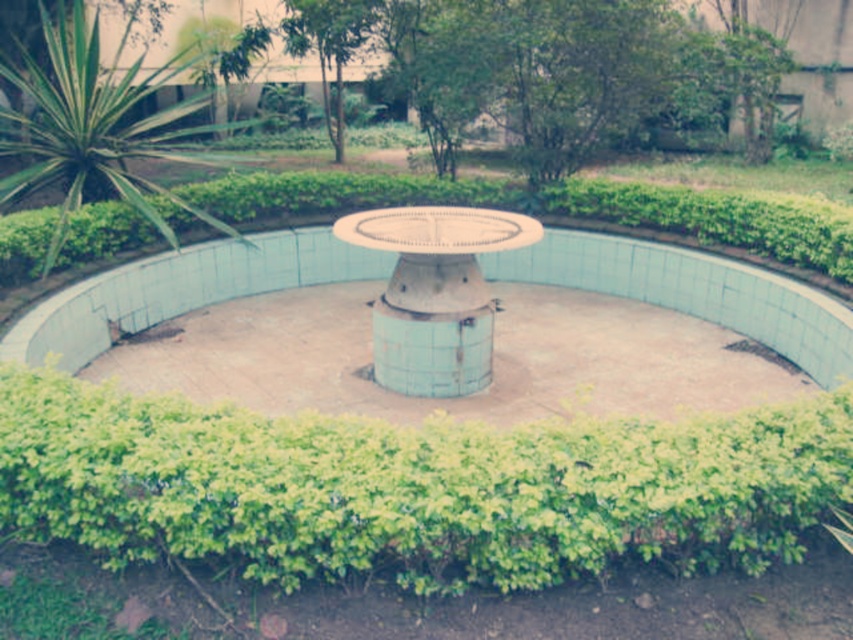
Is point (711, 385) more distant than point (381, 298)?

Yes.

Which is in front, point (782, 292) or point (476, 252)?

Positioned in front is point (476, 252).

The image size is (853, 640). I want to click on blue concrete pool at center, so click(x=492, y=330).

Where is `blue concrete pool at center`? This screenshot has width=853, height=640. blue concrete pool at center is located at coordinates (492, 330).

Is point (215, 358) in front of point (73, 112)?

Yes, point (215, 358) is closer to viewer.

Where is `blue concrete pool at center`? This screenshot has width=853, height=640. blue concrete pool at center is located at coordinates (492, 330).

Is point (51, 493) farther from viewer compared to point (347, 397)?

No, it is not.

Does point (33, 500) come closer to viewer compared to point (549, 276)?

Yes, it is in front of point (549, 276).

The height and width of the screenshot is (640, 853). Find the location of `green leafy hedge at lower center`. green leafy hedge at lower center is located at coordinates (412, 486).